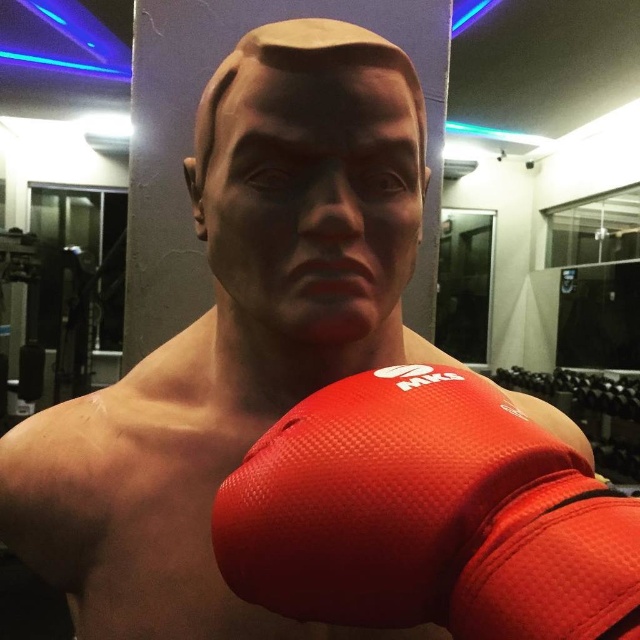
You are a gym trainer planning to place a new poster on the wall behind the mannequin. The poster is 1 meter wide. The point where you want to place the center of the poster is at point (x=428, y=516). The red mesh boxing glove at center is currently occupying that point. Can you move the glove to the right by 0.1 units so that the poster can be centered at the original point?

The red mesh boxing glove at center is currently at point (x=428, y=516). Moving it to the right by 0.1 units would place it at point 0.908, 0.669. This would allow the poster to be centered at the original point (x=428, y=516), so yes, moving the glove to the right by 0.1 units would make space for the poster.

You are a boxing trainer observing the mannequin in the gym. You notice the red mesh boxing glove at center and the matte black face at center. Which object is located to the right of the other?

The red mesh boxing glove at center is positioned on the right side of matte black face at center.

You are a gym trainer assessing the equipment in the room. You see the red mesh boxing glove at center and the matte black face at center. Which object is shorter in height?

The red mesh boxing glove at center is not as tall as matte black face at center, so the red mesh boxing glove at center is shorter in height.